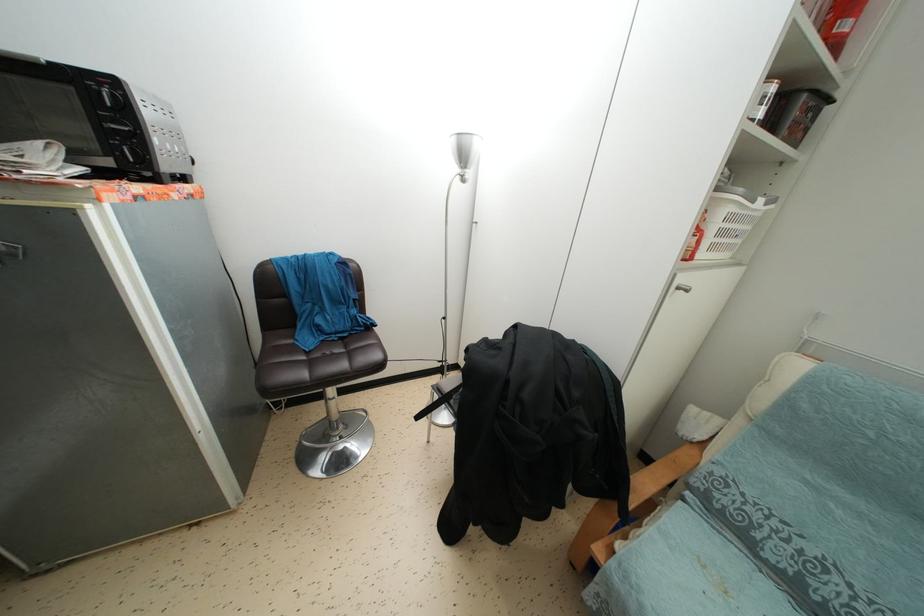
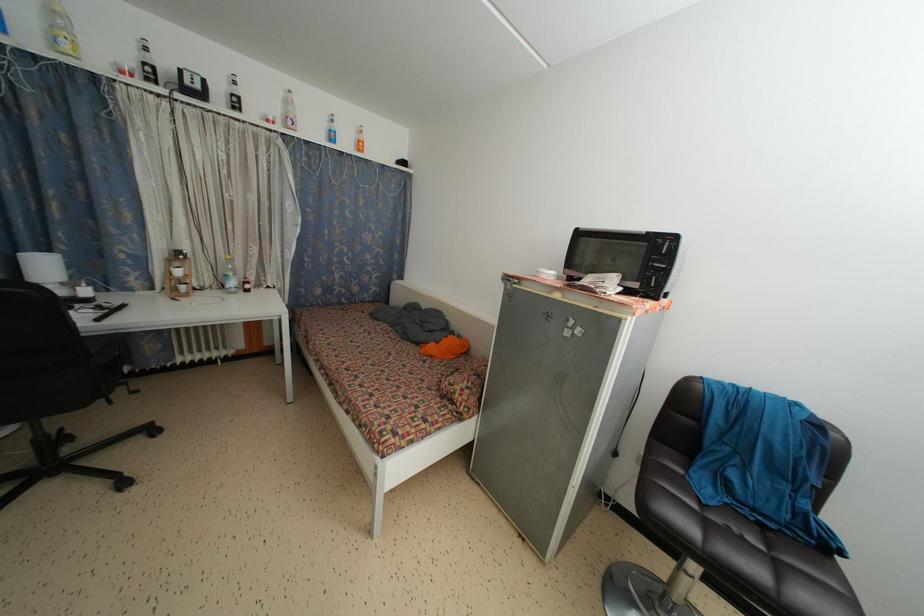
Question: Based on the continuous images, in which direction is the camera rotating? Reply with the corresponding letter.

Choices:
 (A) Left
 (B) Right
 (C) Up
 (D) Down

Answer: (A)